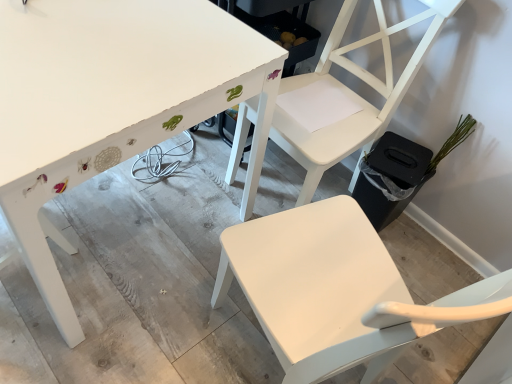
Question: Is white matte chair at upper center, positioned as the 2th chair in top-to-bottom order, a part of white matte chair at upper right, the 2th chair when ordered from bottom to top?

Choices:
 (A) no
 (B) yes

Answer: (A)

Question: Is white matte chair at upper right, the 2th chair when ordered from bottom to top, at the right side of white matte chair at upper center, the 1th chair positioned from the bottom?

Choices:
 (A) yes
 (B) no

Answer: (A)

Question: Is white matte chair at upper right, the 2th chair when ordered from bottom to top, closer to camera compared to white matte chair at upper center, positioned as the 2th chair in top-to-bottom order?

Choices:
 (A) yes
 (B) no

Answer: (B)

Question: Could you tell me if white matte chair at upper right, which is the first chair in top-to-bottom order, is turned towards white matte chair at upper center, positioned as the 2th chair in top-to-bottom order?

Choices:
 (A) no
 (B) yes

Answer: (A)

Question: Considering the relative sizes of white matte chair at upper right, the 2th chair when ordered from bottom to top, and white matte chair at upper center, the 1th chair positioned from the bottom, in the image provided, is white matte chair at upper right, the 2th chair when ordered from bottom to top, thinner than white matte chair at upper center, the 1th chair positioned from the bottom,?

Choices:
 (A) no
 (B) yes

Answer: (B)

Question: Visually, is green matte plant at right positioned to the left or to the right of white matte chair at upper center, positioned as the 2th chair in top-to-bottom order?

Choices:
 (A) right
 (B) left

Answer: (A)

Question: In terms of width, does green matte plant at right look wider or thinner when compared to white matte chair at upper center, the 1th chair positioned from the bottom?

Choices:
 (A) wide
 (B) thin

Answer: (B)

Question: Is green matte plant at right taller or shorter than white matte chair at upper center, positioned as the 2th chair in top-to-bottom order?

Choices:
 (A) tall
 (B) short

Answer: (B)

Question: From a real-world perspective, is green matte plant at right positioned above or below white matte chair at upper center, the 1th chair positioned from the bottom?

Choices:
 (A) below
 (B) above

Answer: (A)

Question: In the image, is green matte plant at right positioned in front of or behind white painted wood table at upper left?

Choices:
 (A) front
 (B) behind

Answer: (B)

Question: In the image, is green matte plant at right on the left side or the right side of white painted wood table at upper left?

Choices:
 (A) left
 (B) right

Answer: (B)

Question: In terms of height, does green matte plant at right look taller or shorter compared to white painted wood table at upper left?

Choices:
 (A) short
 (B) tall

Answer: (A)

Question: Is point (448, 147) positioned closer to the camera than point (66, 18)?

Choices:
 (A) closer
 (B) farther

Answer: (B)

Question: Relative to white painted wood table at upper left, is white matte chair at upper right, the 2th chair when ordered from bottom to top, in front or behind?

Choices:
 (A) front
 (B) behind

Answer: (B)

Question: Which is correct: white matte chair at upper right, which is the first chair in top-to-bottom order, is inside white painted wood table at upper left, or outside of it?

Choices:
 (A) outside
 (B) inside

Answer: (A)